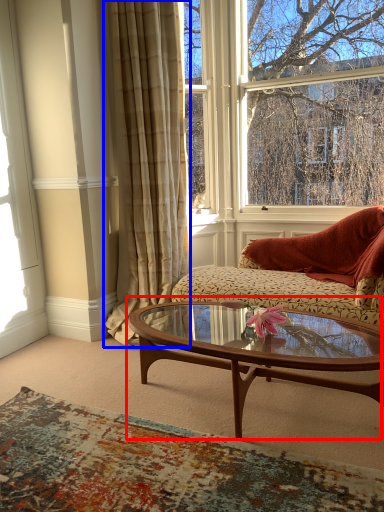
Question: Which of the following is the farthest to the observer, coffee table (highlighted by a red box) or curtain (highlighted by a blue box)?

Choices:
 (A) coffee table
 (B) curtain

Answer: (B)